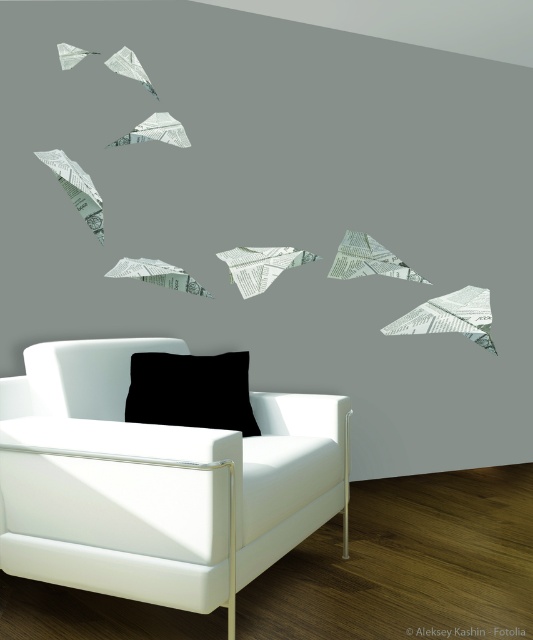
Question: Can you confirm if white leather armchair at lower left is positioned to the left of black matte pillow at lower center?

Choices:
 (A) yes
 (B) no

Answer: (B)

Question: Among these points, which one is nearest to the camera?

Choices:
 (A) (221, 385)
 (B) (294, 481)

Answer: (B)

Question: Can you confirm if white leather armchair at lower left is positioned above black matte pillow at lower center?

Choices:
 (A) no
 (B) yes

Answer: (A)

Question: Does white leather armchair at lower left lie behind black matte pillow at lower center?

Choices:
 (A) no
 (B) yes

Answer: (A)

Question: Among these objects, which one is nearest to the camera?

Choices:
 (A) black matte pillow at lower center
 (B) white leather armchair at lower left

Answer: (B)